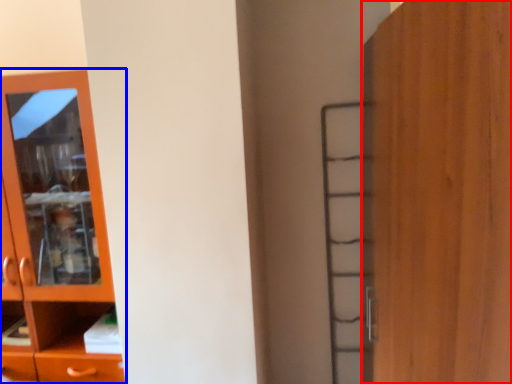
Question: Which of the following is the closest to the observer, door (highlighted by a red box) or cupboard (highlighted by a blue box)?

Choices:
 (A) door
 (B) cupboard

Answer: (A)